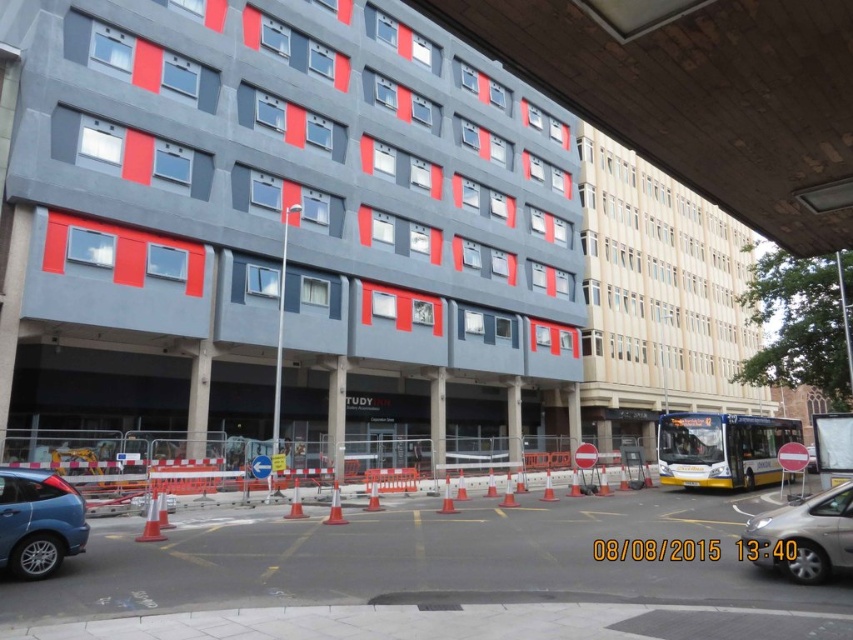
Which is more to the right, metallic blue suv at lower left or silver metallic car at lower right?

silver metallic car at lower right is more to the right.

Is metallic blue suv at lower left below silver metallic car at lower right?

No.

Where is `metallic blue suv at lower left`? metallic blue suv at lower left is located at coordinates (38, 522).